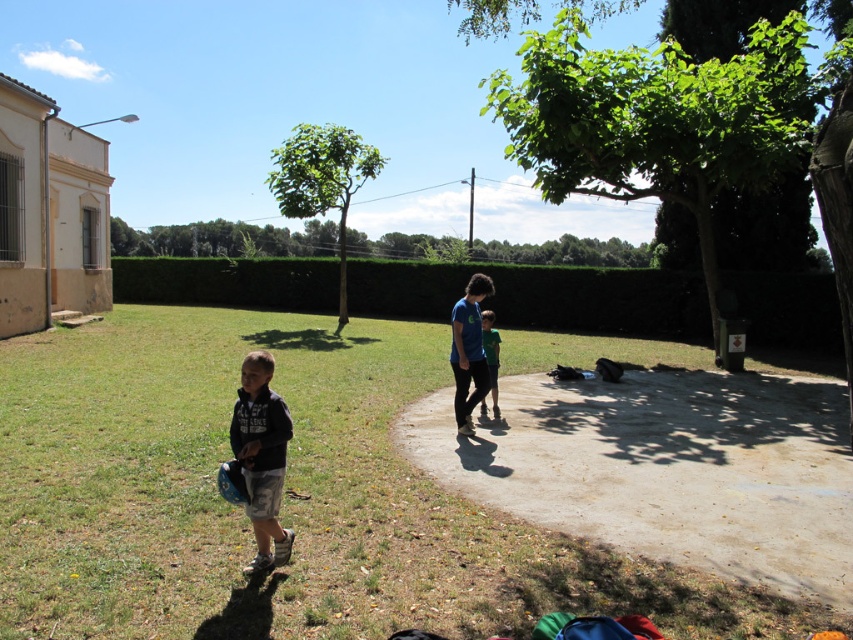
Question: Is green leafy hedge at center below dark gray cotton shirt at lower left?

Choices:
 (A) no
 (B) yes

Answer: (A)

Question: Which point is farther from the camera taking this photo?

Choices:
 (A) click(485, 403)
 (B) click(323, 628)

Answer: (A)

Question: Which point appears closest to the camera in this image?

Choices:
 (A) (473, 472)
 (B) (270, 556)
 (C) (466, 275)

Answer: (B)

Question: Is green leafy hedge at center in front of dark gray cotton shirt at lower left?

Choices:
 (A) no
 (B) yes

Answer: (A)

Question: Is green grass at lower left thinner than green matte shirt at center?

Choices:
 (A) yes
 (B) no

Answer: (B)

Question: Which is farther from the green grass at lower left?

Choices:
 (A) green leafy hedge at center
 (B) dark gray cotton shirt at lower left
 (C) dirt path at center

Answer: (A)